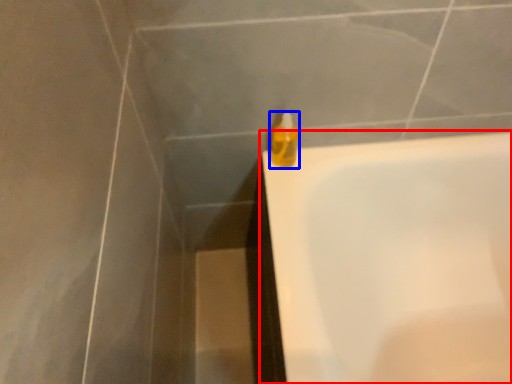
Question: Which point is closer to the camera, bathtub (highlighted by a red box) or liquid (highlighted by a blue box)?

Choices:
 (A) bathtub
 (B) liquid

Answer: (A)